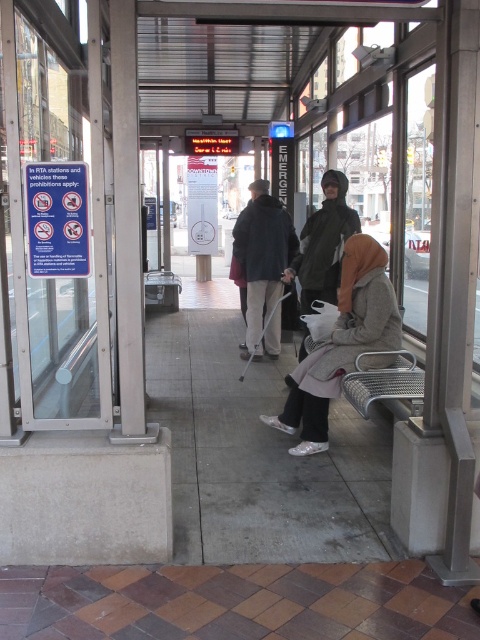
Question: Which is nearer to the dark green jacket at center?

Choices:
 (A) dark blue jacket at center
 (B) metallic silver bench at lower right

Answer: (A)

Question: Among these points, which one is farthest from the camera?

Choices:
 (A) (377, 388)
 (B) (307, 444)

Answer: (B)

Question: Is dark green jacket at center smaller than metallic silver bench at lower right?

Choices:
 (A) yes
 (B) no

Answer: (B)

Question: Considering the real-world distances, which object is farthest from the matte gray coat at center?

Choices:
 (A) dark green jacket at center
 (B) brown tile pavement at lower center

Answer: (B)

Question: Does brown tile pavement at lower center come in front of dark green jacket at center?

Choices:
 (A) no
 (B) yes

Answer: (B)

Question: Does matte gray coat at center appear under dark green jacket at center?

Choices:
 (A) yes
 (B) no

Answer: (A)